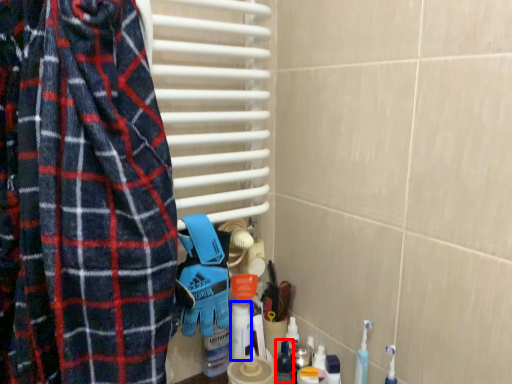
Question: Which object appears farthest to the camera in this image, toiletry (highlighted by a red box) or cleaning product (highlighted by a blue box)?

Choices:
 (A) toiletry
 (B) cleaning product

Answer: (B)